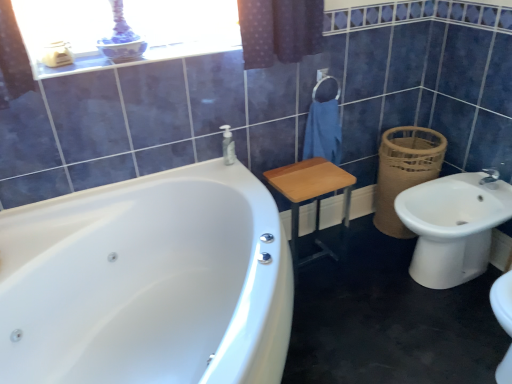
Question: Is wooden stool at center taller than white glossy bathtub at left?

Choices:
 (A) no
 (B) yes

Answer: (A)

Question: Can you confirm if wooden stool at center is smaller than white glossy bathtub at left?

Choices:
 (A) no
 (B) yes

Answer: (B)

Question: Is wooden stool at center to the right of white glossy bathtub at left from the viewer's perspective?

Choices:
 (A) yes
 (B) no

Answer: (A)

Question: Could you tell me if wooden stool at center is turned towards white glossy bathtub at left?

Choices:
 (A) no
 (B) yes

Answer: (A)

Question: Is white glossy bathtub at left completely or partially inside wooden stool at center?

Choices:
 (A) no
 (B) yes

Answer: (A)

Question: Is blue cotton towel at center taller or shorter than wooden stool at center?

Choices:
 (A) tall
 (B) short

Answer: (B)

Question: Visually, is blue cotton towel at center positioned to the left or to the right of wooden stool at center?

Choices:
 (A) left
 (B) right

Answer: (B)

Question: Is blue cotton towel at center spatially inside wooden stool at center, or outside of it?

Choices:
 (A) inside
 (B) outside

Answer: (B)

Question: From the image's perspective, is blue cotton towel at center above or below wooden stool at center?

Choices:
 (A) above
 (B) below

Answer: (A)

Question: Considering the relative positions of white glossy bathtub at left and blue cotton towel at center in the image provided, is white glossy bathtub at left to the left or to the right of blue cotton towel at center?

Choices:
 (A) left
 (B) right

Answer: (A)

Question: Relative to blue cotton towel at center, is white glossy bathtub at left in front or behind?

Choices:
 (A) front
 (B) behind

Answer: (A)

Question: Is point (25, 218) positioned closer to the camera than point (335, 152)?

Choices:
 (A) farther
 (B) closer

Answer: (B)

Question: Looking at their shapes, would you say white glossy bathtub at left is wider or thinner than blue cotton towel at center?

Choices:
 (A) thin
 (B) wide

Answer: (B)

Question: From a real-world perspective, relative to white glossy bathtub at left, is brown woven basket at right vertically above or below?

Choices:
 (A) above
 (B) below

Answer: (B)

Question: Considering the positions of brown woven basket at right and white glossy bathtub at left in the image, is brown woven basket at right taller or shorter than white glossy bathtub at left?

Choices:
 (A) short
 (B) tall

Answer: (A)